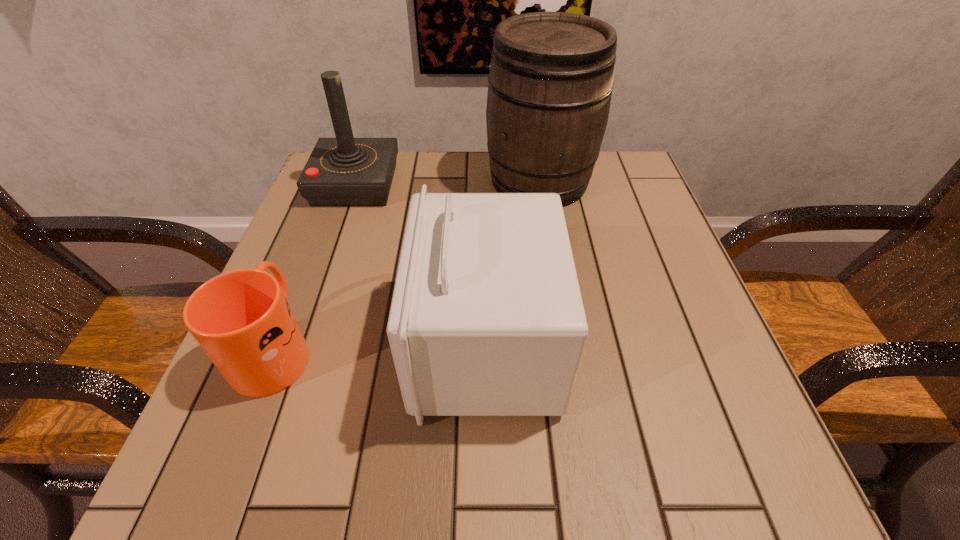
This screenshot has height=540, width=960. In the image, there is a desktop. Find the location of `free region at the near edge`. free region at the near edge is located at coordinates (540, 473).

In the image, there is a desktop. Identify the location of vacant space at the left edge. (336, 333).

Locate an element on the screen. This screenshot has height=540, width=960. free space at the right edge of the desktop is located at coordinates (617, 294).

The height and width of the screenshot is (540, 960). What are the coordinates of `vacant area at the far right corner` in the screenshot? It's located at (657, 207).

Where is `unoccupied position between the mug and the joystick`? The width and height of the screenshot is (960, 540). unoccupied position between the mug and the joystick is located at coordinates pyautogui.click(x=315, y=266).

Where is `blank region between the shortest object and the first-aid kit`? This screenshot has height=540, width=960. blank region between the shortest object and the first-aid kit is located at coordinates (380, 346).

The image size is (960, 540). Find the location of `free area in between the first-aid kit and the mug`. free area in between the first-aid kit and the mug is located at coordinates (380, 346).

What are the coordinates of `vacant area between the first-aid kit and the mug` in the screenshot? It's located at (380, 346).

Locate which object is the third closest to the wine bucket. Please provide its 2D coordinates. Your answer should be formatted as a tuple, i.e. [(x, y)], where the tuple contains the x and y coordinates of a point satisfying the conditions above.

[(241, 319)]

In order to click on the closest object to the joystick in this screenshot , I will do `click(550, 84)`.